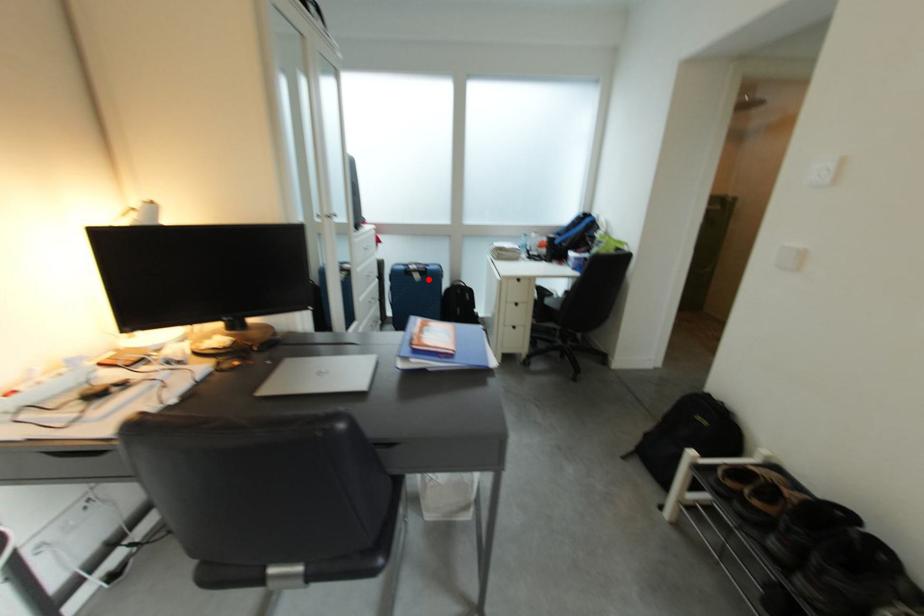
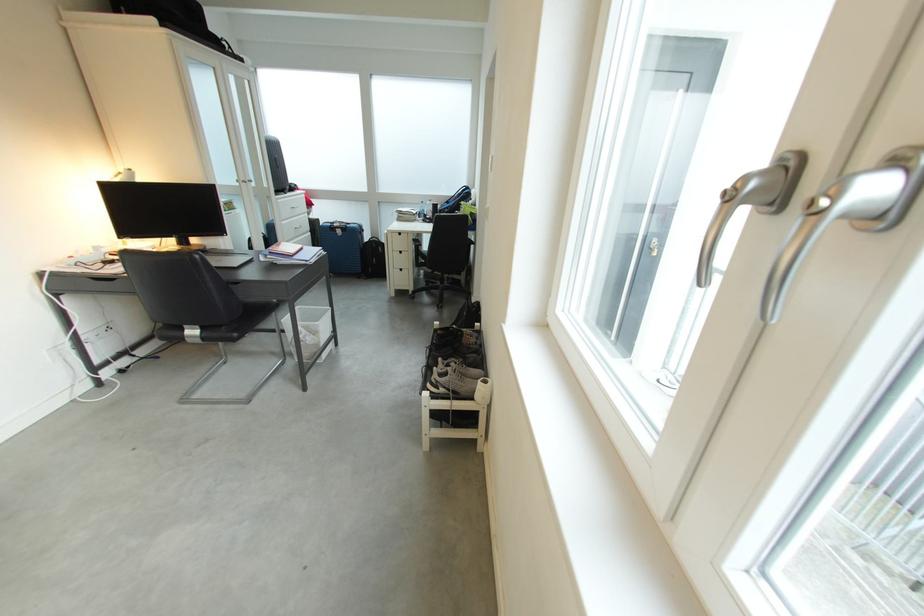
Question: I am providing you with two images of the same scene from different viewpoints. A red point is shown in image1. For the corresponding object point in image2, is it positioned nearer or farther from the camera?

Choices:
 (A) Nearer
 (B) Farther

Answer: (A)